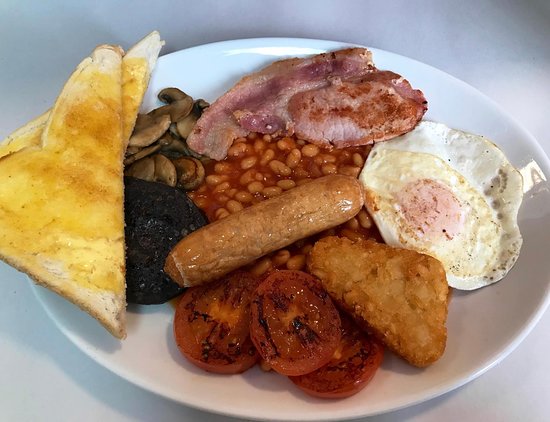
The height and width of the screenshot is (422, 550). I want to click on table, so 90,396.